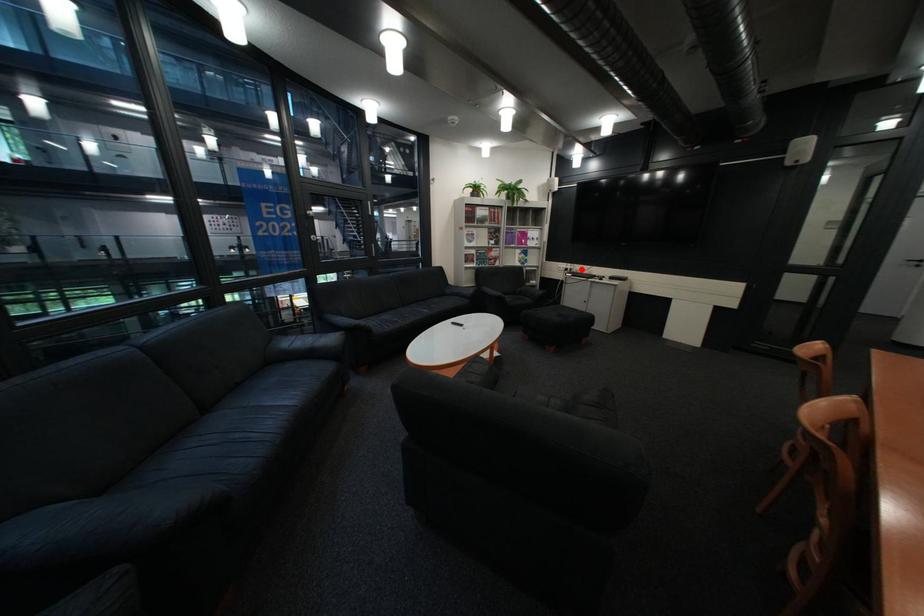
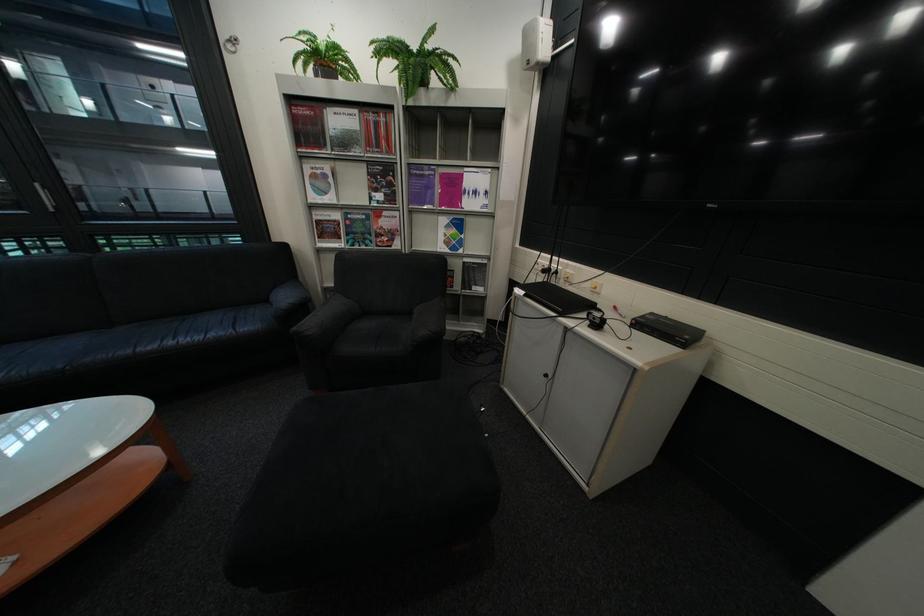
Question: I am providing you with two images of the same scene from different viewpoints. Image1 has a red point marked. In image2, the corresponding 3D location appears at what relative position? Reply with the corresponding letter.

Choices:
 (A) Closer
 (B) Farther

Answer: (B)